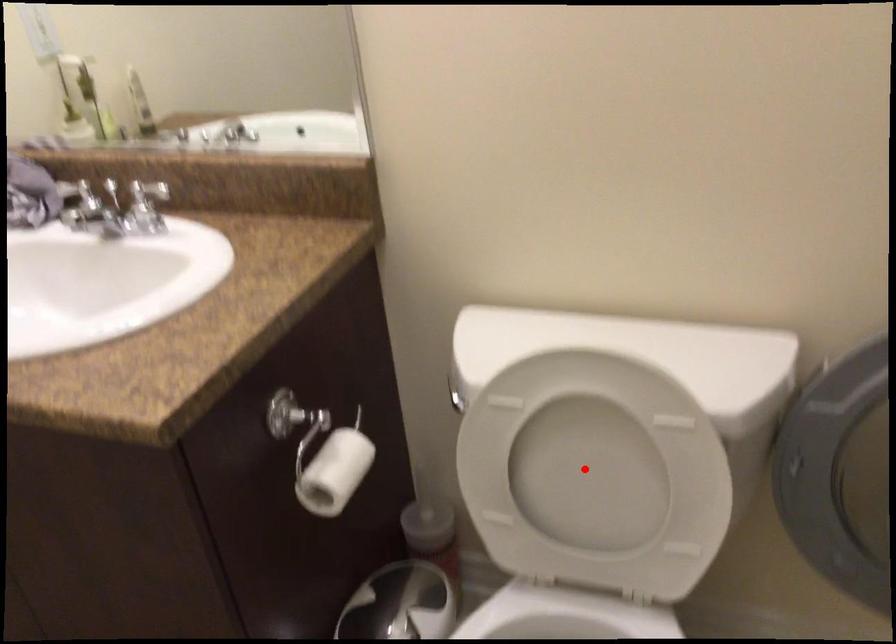
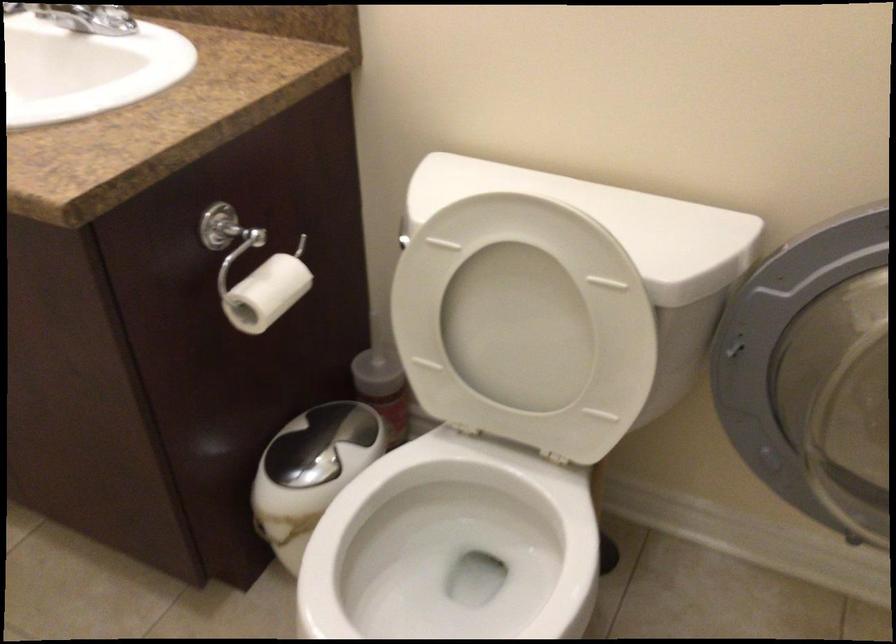
In the second image, find the point that corresponds to the highlighted location in the first image.

(517, 328)